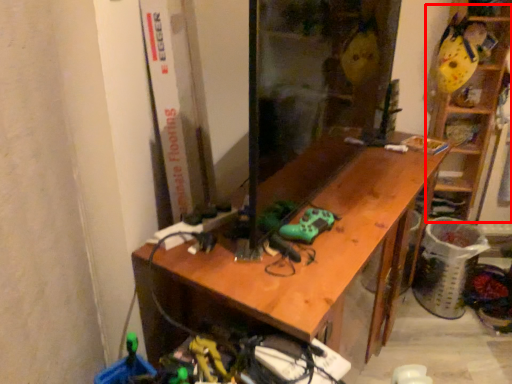
Question: From the image's perspective, where is shelf (annotated by the red box) located relative to desk?

Choices:
 (A) above
 (B) below

Answer: (A)